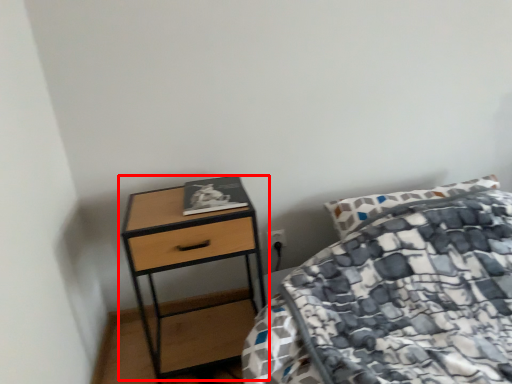
Question: From the image's perspective, what is the correct spatial relationship of table (annotated by the red box) in relation to book?

Choices:
 (A) above
 (B) below

Answer: (B)